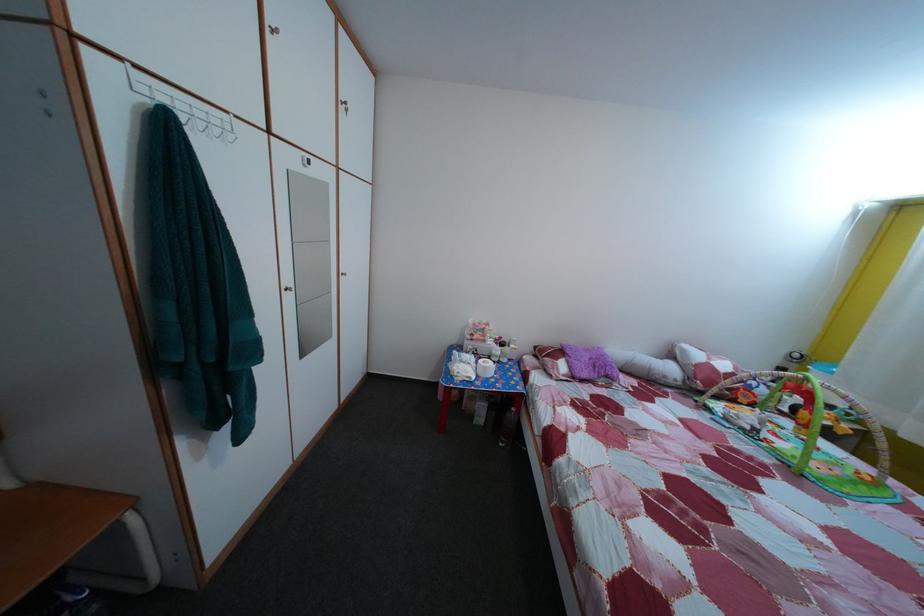
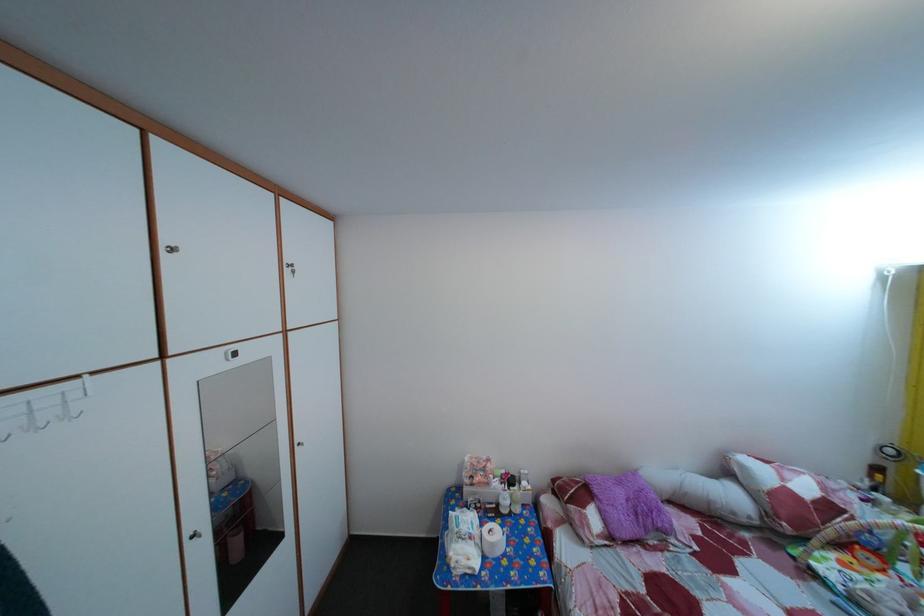
The point at (597, 358) is marked in the first image. Where is the corresponding point in the second image?

(629, 491)